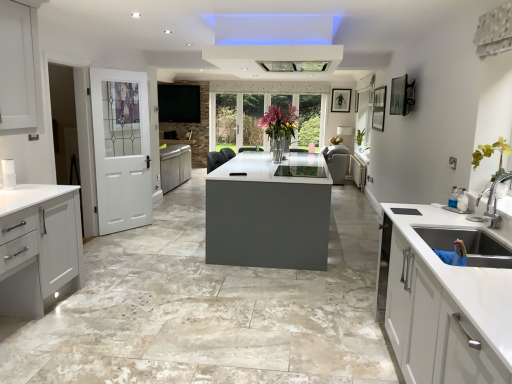
Where is `vacant space in white painted wood door at left (from a real-world perspective)`? The height and width of the screenshot is (384, 512). vacant space in white painted wood door at left (from a real-world perspective) is located at coordinates (124, 230).